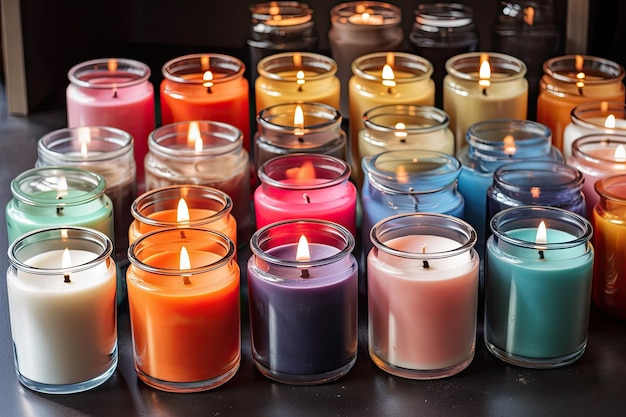
The image size is (626, 417). Identify the location of base of candles. point(73,387), point(173,385), point(310,378), point(433,371), point(535,363).